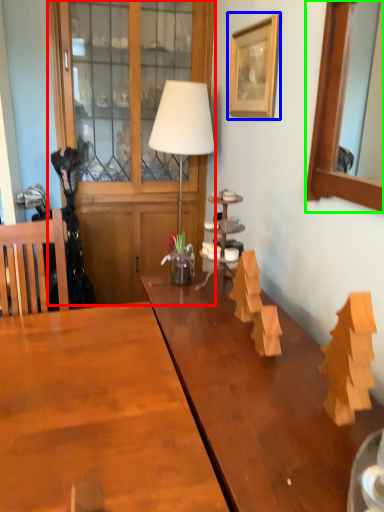
Question: Based on their relative distances, which object is farther from dresser (highlighted by a red box)? Choose from picture frame (highlighted by a blue box) and picture frame (highlighted by a green box).

Choices:
 (A) picture frame
 (B) picture frame

Answer: (B)